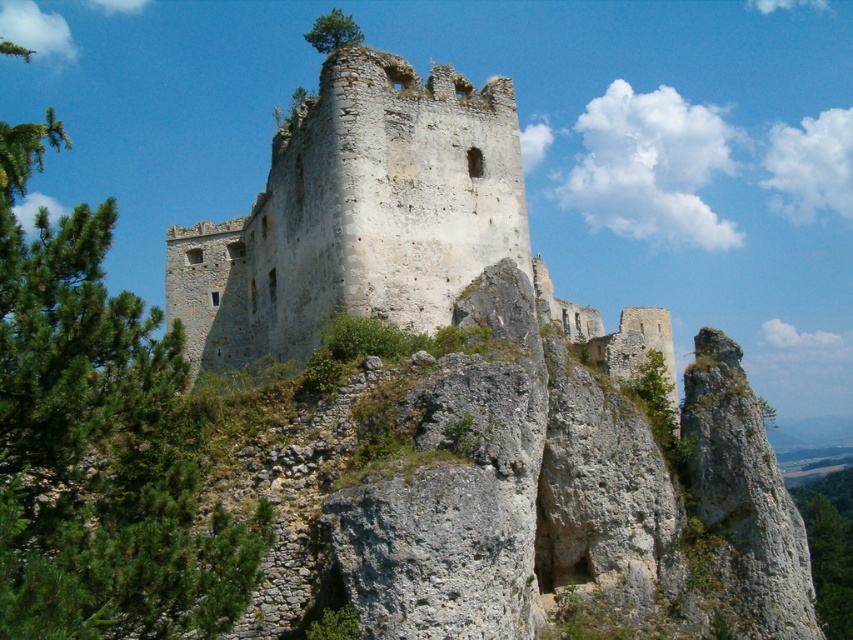
Question: Which of the following is the closest to the observer?

Choices:
 (A) (163, 416)
 (B) (328, 35)

Answer: (A)

Question: Which object is positioned farthest from the weathered stone castle at center?

Choices:
 (A) green leafy tree at left
 (B) green leafy tree at upper center

Answer: (A)

Question: Considering the relative positions of green leafy tree at left and weathered stone castle at center in the image provided, where is green leafy tree at left located with respect to weathered stone castle at center?

Choices:
 (A) left
 (B) right

Answer: (A)

Question: Does green leafy tree at left appear under weathered stone castle at center?

Choices:
 (A) yes
 (B) no

Answer: (B)

Question: Which of the following is the closest to the observer?

Choices:
 (A) green leafy tree at upper center
 (B) green leafy tree at left
 (C) weathered stone castle at center

Answer: (B)

Question: Can you confirm if green leafy tree at left is wider than green leafy tree at upper center?

Choices:
 (A) no
 (B) yes

Answer: (B)